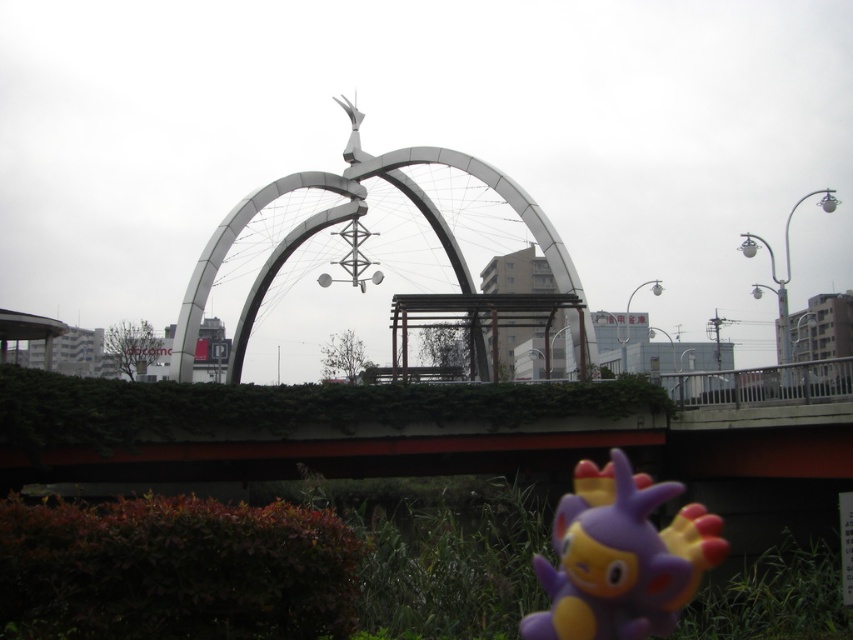
Question: Can you confirm if green ivy-covered bridge at center is positioned above purple matte toy at lower center?

Choices:
 (A) yes
 (B) no

Answer: (A)

Question: Which of the following is the farthest from the observer?

Choices:
 (A) (315, 410)
 (B) (563, 586)
 (C) (227, 218)

Answer: (C)

Question: Does green ivy-covered bridge at center lie behind metallic silver archway at center?

Choices:
 (A) no
 (B) yes

Answer: (A)

Question: Considering the real-world distances, which object is closest to the green ivy-covered bridge at center?

Choices:
 (A) purple matte toy at lower center
 (B) metallic silver archway at center

Answer: (A)

Question: Is green ivy-covered bridge at center to the left of purple matte toy at lower center from the viewer's perspective?

Choices:
 (A) no
 (B) yes

Answer: (B)

Question: Which object is positioned closest to the purple matte toy at lower center?

Choices:
 (A) green ivy-covered bridge at center
 (B) metallic silver archway at center

Answer: (A)